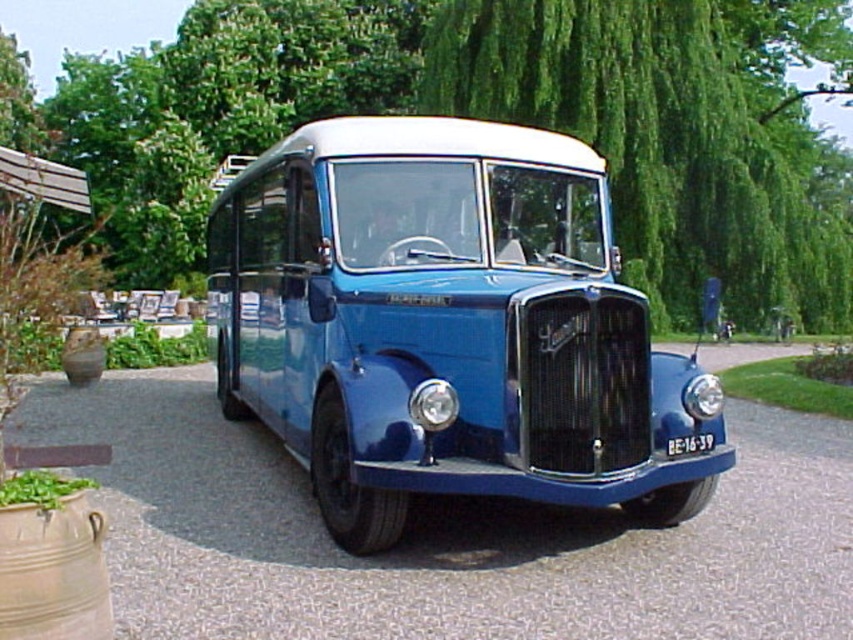
Looking at this image, which is above, blue asphalt driveway at center or white plastic license plate at center?

white plastic license plate at center

Who is positioned more to the left, blue asphalt driveway at center or white plastic license plate at center?

blue asphalt driveway at center is more to the left.

What are the coordinates of `blue asphalt driveway at center` in the screenshot? It's located at (444, 536).

Does shiny blue bus at center appear over green leafy tree at center?

Actually, shiny blue bus at center is below green leafy tree at center.

In order to click on shiny blue bus at center in this screenshot , I will do `click(445, 324)`.

Find the location of a particular element. Image resolution: width=853 pixels, height=640 pixels. shiny blue bus at center is located at coordinates (445, 324).

Which is behind, point (415, 438) or point (699, 440)?

Positioned behind is point (699, 440).

Is point (215, 264) positioned after point (704, 444)?

Yes, it is.

In order to click on shiny blue bus at center in this screenshot , I will do `click(445, 324)`.